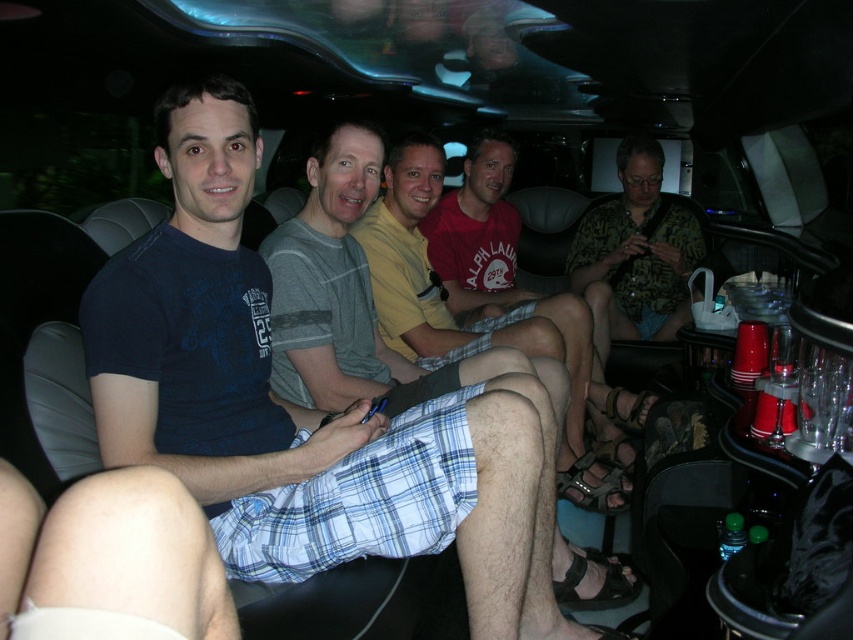
Question: From the image, what is the correct spatial relationship of gray cotton t-shirt at center in relation to printed fabric shirt at center?

Choices:
 (A) above
 (B) below

Answer: (B)

Question: Is gray cotton t-shirt at center smaller than printed fabric shirt at center?

Choices:
 (A) no
 (B) yes

Answer: (B)

Question: Can you confirm if gray cotton t-shirt at center is bigger than printed fabric shirt at center?

Choices:
 (A) no
 (B) yes

Answer: (A)

Question: Which point is closer to the camera?

Choices:
 (A) (376, 173)
 (B) (583, 276)

Answer: (A)

Question: Which point is closer to the camera?

Choices:
 (A) (593, 340)
 (B) (302, 358)

Answer: (B)